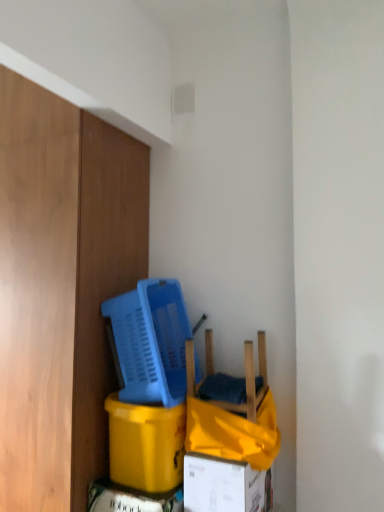
Question: From a real-world perspective, does yellow cardboard box at lower left stand above blue plastic basket at center?

Choices:
 (A) no
 (B) yes

Answer: (A)

Question: Would you say yellow cardboard box at lower left contains blue plastic basket at center?

Choices:
 (A) no
 (B) yes

Answer: (A)

Question: Considering the relative positions of yellow cardboard box at lower left and blue plastic basket at center in the image provided, is yellow cardboard box at lower left in front of blue plastic basket at center?

Choices:
 (A) no
 (B) yes

Answer: (A)

Question: Is yellow cardboard box at lower left behind blue plastic basket at center?

Choices:
 (A) no
 (B) yes

Answer: (B)

Question: Does yellow cardboard box at lower left have a lesser width compared to blue plastic basket at center?

Choices:
 (A) no
 (B) yes

Answer: (B)

Question: Considering the positions of point (208, 357) and point (180, 365), is point (208, 357) closer or farther from the camera than point (180, 365)?

Choices:
 (A) closer
 (B) farther

Answer: (B)

Question: Is wooden chair at lower center wider or thinner than blue plastic basket at center?

Choices:
 (A) wide
 (B) thin

Answer: (B)

Question: Is wooden chair at lower center inside or outside of blue plastic basket at center?

Choices:
 (A) inside
 (B) outside

Answer: (B)

Question: In terms of height, does wooden chair at lower center look taller or shorter compared to blue plastic basket at center?

Choices:
 (A) tall
 (B) short

Answer: (B)

Question: Which is correct: wooden chair at lower center is inside yellow cardboard box at lower left, or outside of it?

Choices:
 (A) inside
 (B) outside

Answer: (B)

Question: Is wooden chair at lower center taller or shorter than yellow cardboard box at lower left?

Choices:
 (A) short
 (B) tall

Answer: (A)

Question: Looking at their shapes, would you say wooden chair at lower center is wider or thinner than yellow cardboard box at lower left?

Choices:
 (A) thin
 (B) wide

Answer: (A)

Question: From a real-world perspective, is wooden chair at lower center physically located above or below yellow cardboard box at lower left?

Choices:
 (A) below
 (B) above

Answer: (B)

Question: Is white cardboard box at lower center inside the boundaries of blue plastic basket at center, or outside?

Choices:
 (A) outside
 (B) inside

Answer: (A)

Question: Is white cardboard box at lower center wider or thinner than blue plastic basket at center?

Choices:
 (A) thin
 (B) wide

Answer: (A)